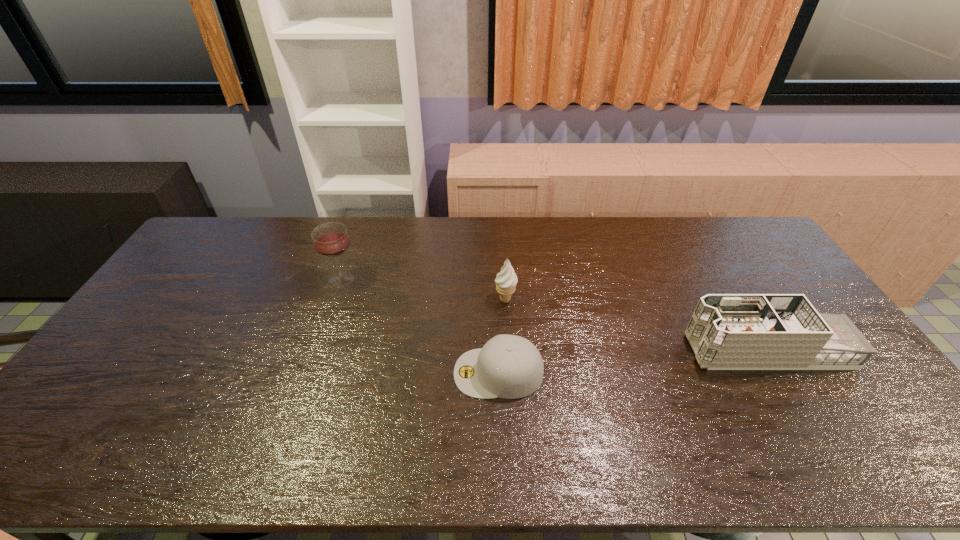
This screenshot has height=540, width=960. Identify the location of object identified as the third closest to the icecream. (727, 331).